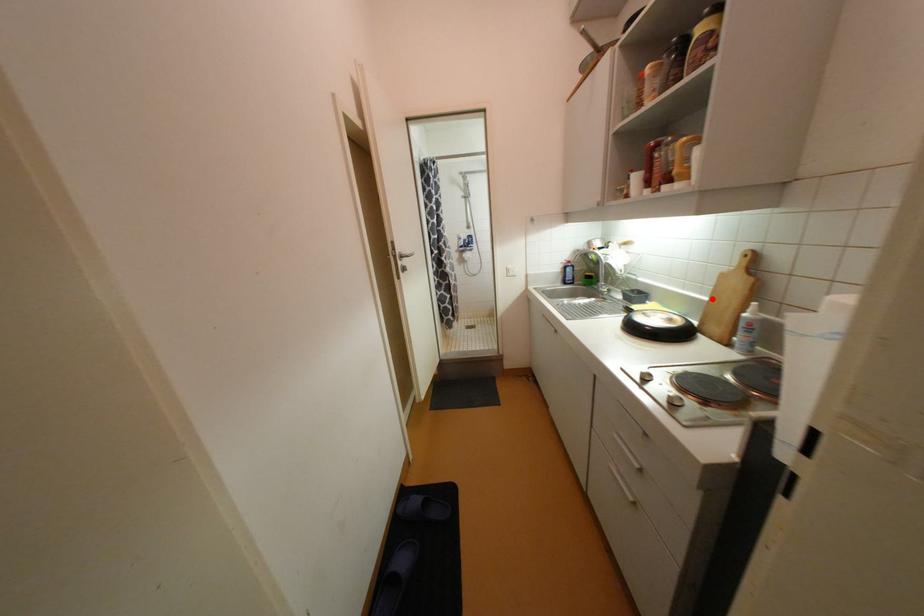
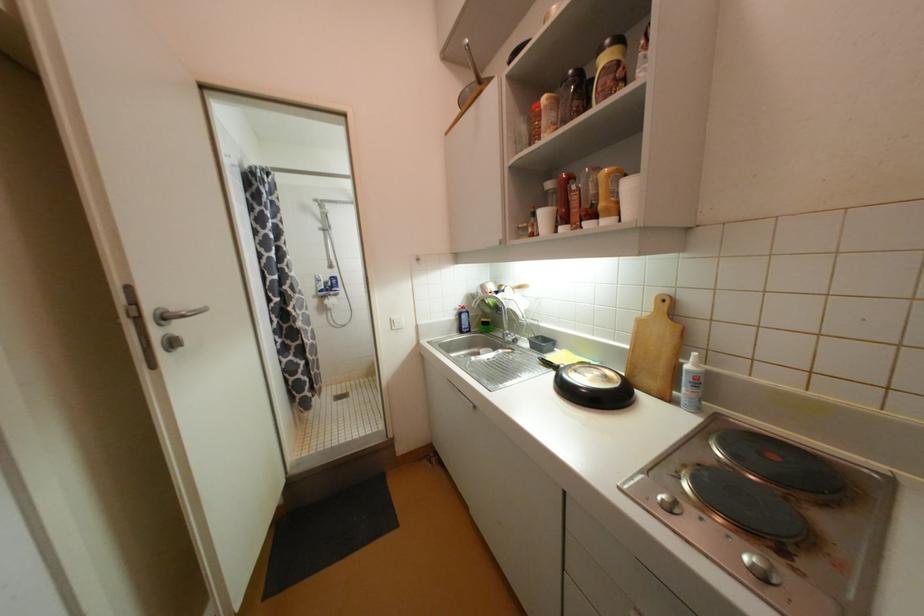
Where in the second image is the point corresponding to the highlighted location from the first image?

(633, 346)